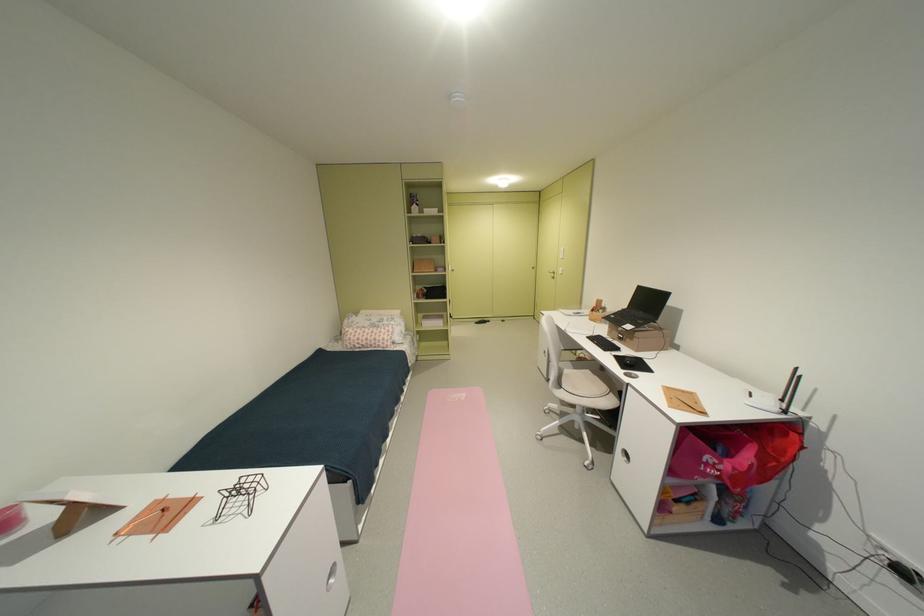
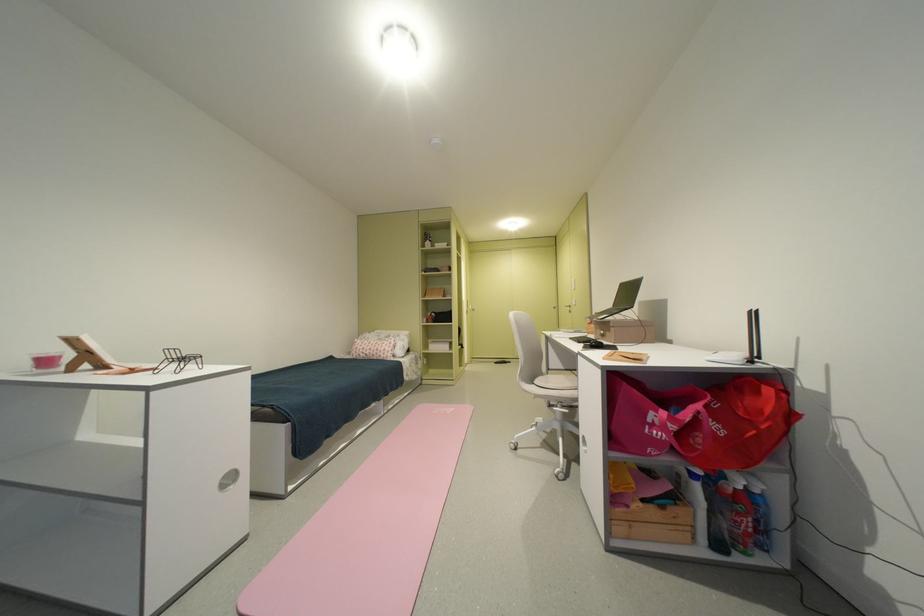
Question: How did the camera likely rotate?

Choices:
 (A) Left
 (B) Right
 (C) Up
 (D) Down

Answer: (C)